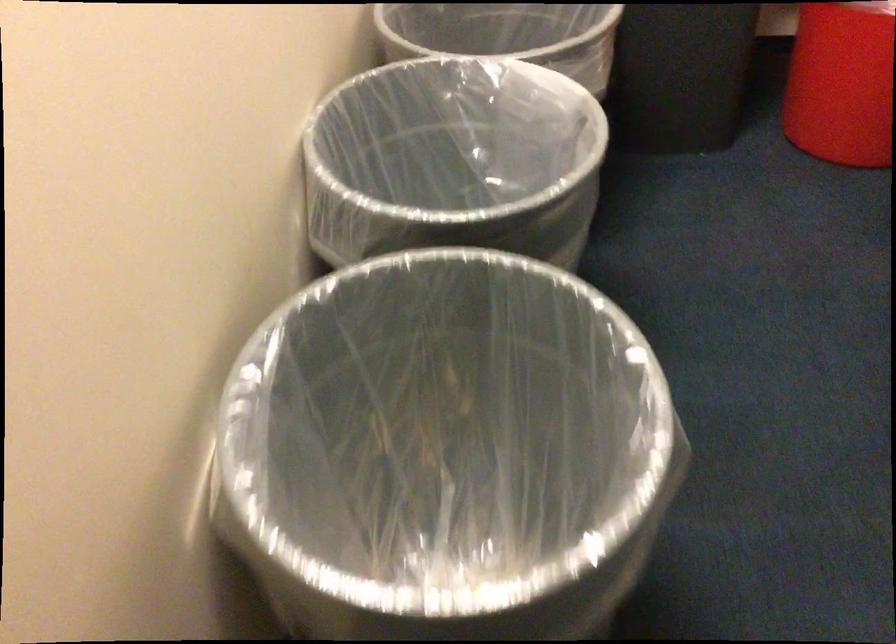
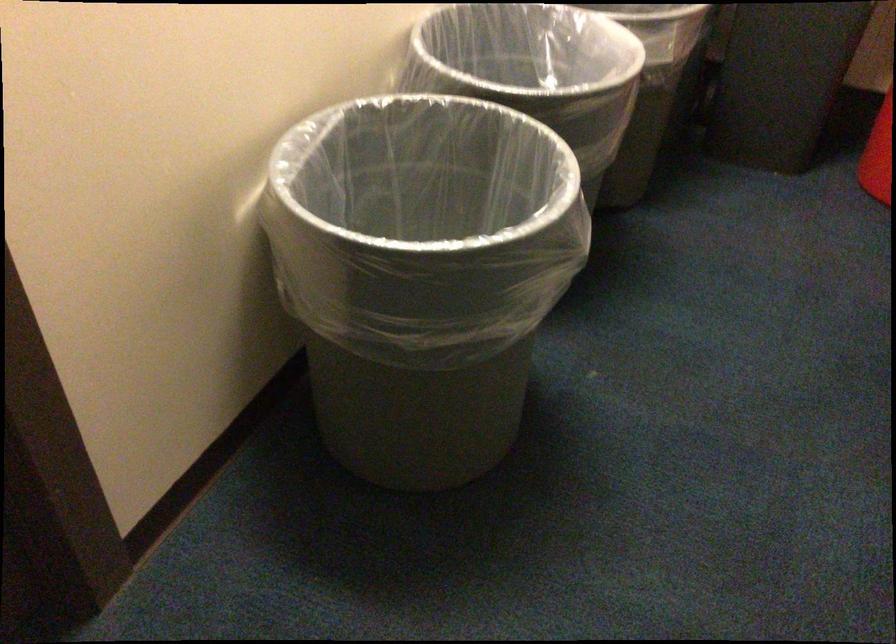
Find the pixel in the second image that matches (401,422) in the first image.

(410, 231)